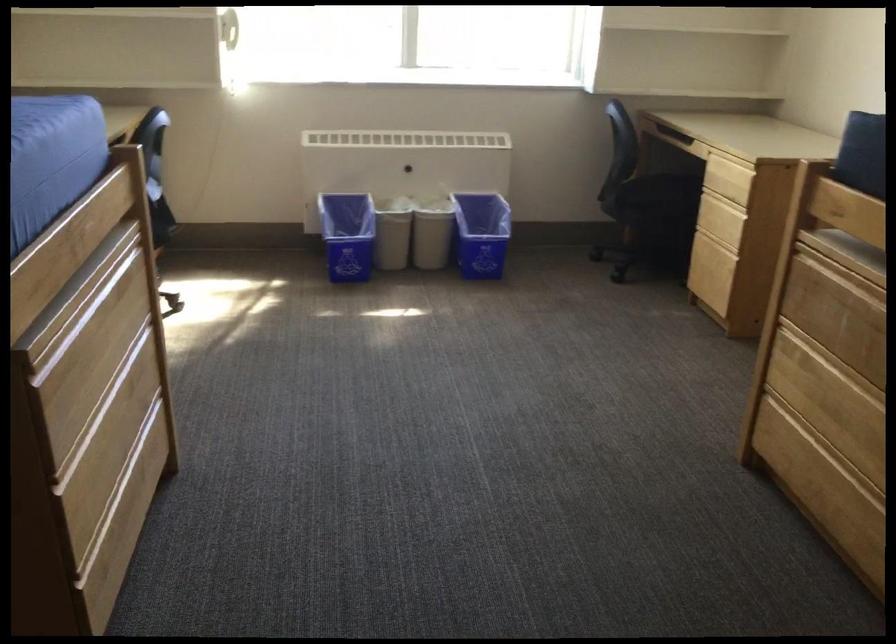
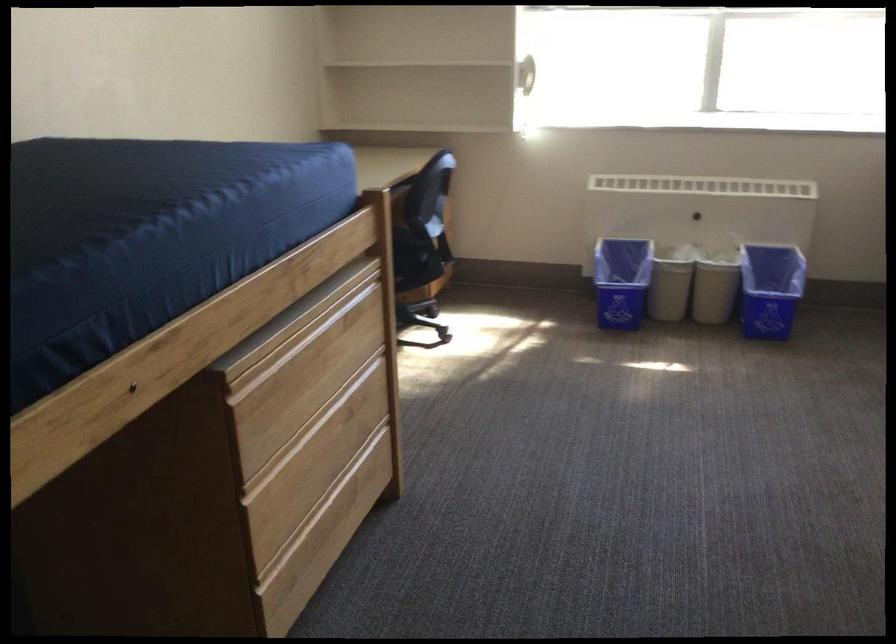
The point at (128, 506) is marked in the first image. Where is the corresponding point in the second image?

(330, 523)